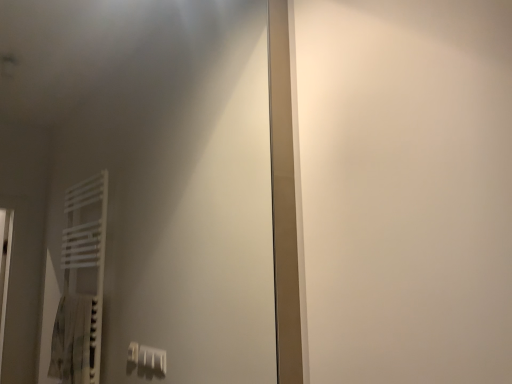
What do you see at coordinates (137, 191) in the screenshot? Image resolution: width=512 pixels, height=384 pixels. I see `white glossy mirror at upper left` at bounding box center [137, 191].

Locate an element on the screen. This screenshot has height=384, width=512. white glossy mirror at upper left is located at coordinates (137, 191).

Where is `white glossy mirror at upper left`? Image resolution: width=512 pixels, height=384 pixels. white glossy mirror at upper left is located at coordinates (137, 191).